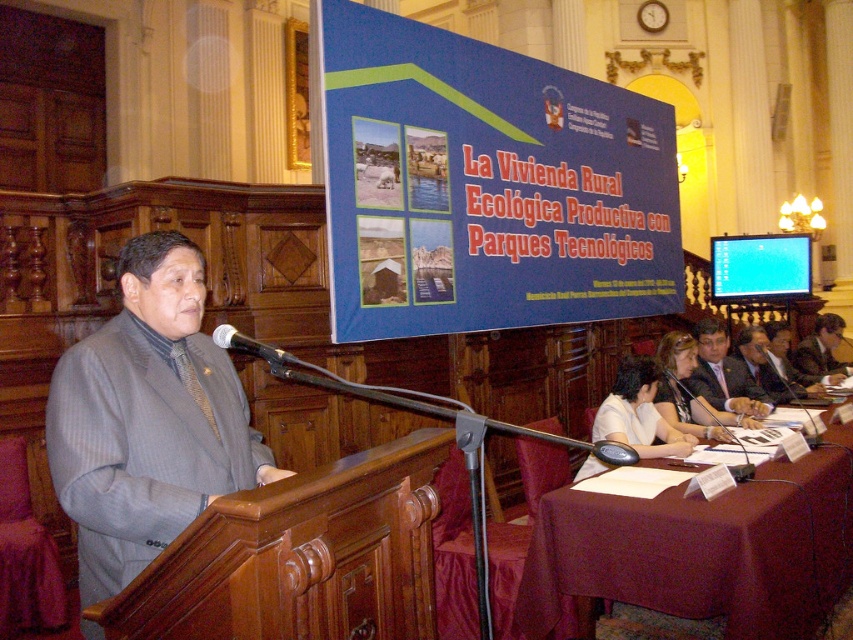
Which of these two, white paper at center or dark gray wool suit at lower right, stands taller?

white paper at center is taller.

Who is more distant from viewer, (653, 362) or (697, 376)?

Point (697, 376)

Which is behind, point (639, 428) or point (718, 368)?

The point (718, 368) is behind.

At what (x,y) coordinates should I click in order to perform the action: click on white paper at center. Please return your answer as a coordinate pair (x, y). Looking at the image, I should click on (637, 413).

What do you see at coordinates (816, 358) in the screenshot? This screenshot has width=853, height=640. I see `dark gray wool business suit at lower right` at bounding box center [816, 358].

Is dark gray wool business suit at lower right positioned at the back of matte black microphone at center?

That is True.

This screenshot has width=853, height=640. Describe the element at coordinates (816, 358) in the screenshot. I see `dark gray wool business suit at lower right` at that location.

Locate an element on the screen. Image resolution: width=853 pixels, height=640 pixels. dark gray wool business suit at lower right is located at coordinates (816, 358).

Which is above, burgundy fabric table at lower right or gray pinstripe suit at center?

gray pinstripe suit at center is higher up.

The image size is (853, 640). What do you see at coordinates (701, 548) in the screenshot?
I see `burgundy fabric table at lower right` at bounding box center [701, 548].

At what (x,y) coordinates should I click in order to perform the action: click on burgundy fabric table at lower right. Please return your answer as a coordinate pair (x, y). Image resolution: width=853 pixels, height=640 pixels. Looking at the image, I should click on (701, 548).